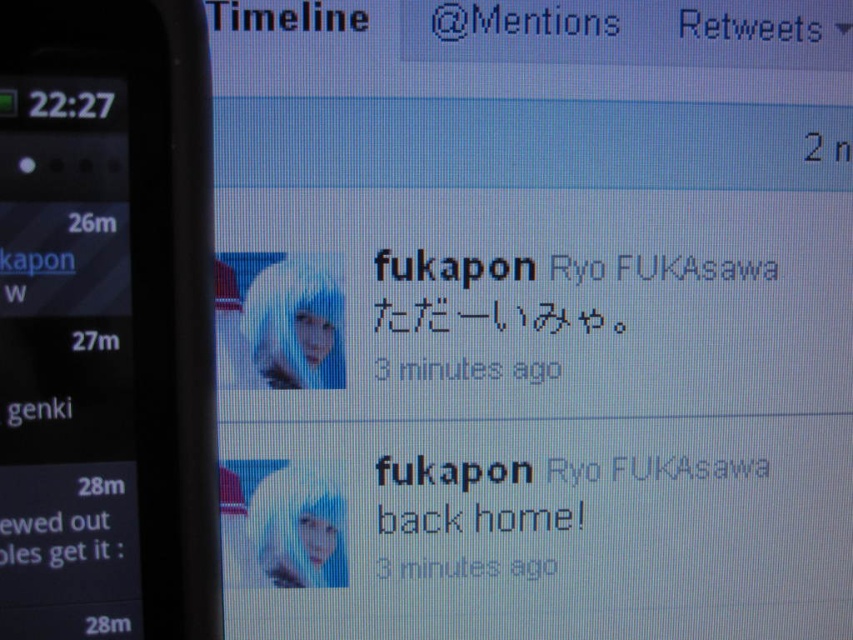
How distant is black matte text at center from black plastic smartphone at left?

black matte text at center and black plastic smartphone at left are 48.04 centimeters apart.

Can you confirm if black matte text at center is shorter than black plastic smartphone at left?

In fact, black matte text at center may be taller than black plastic smartphone at left.

Which is behind, point (605, 272) or point (186, 600)?

The point (605, 272) is behind.

This screenshot has height=640, width=853. I want to click on black matte text at center, so click(x=572, y=401).